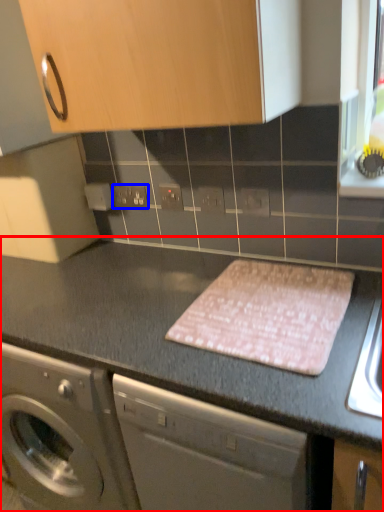
Question: Which of the following is the closest to the observer, countertop (highlighted by a red box) or electric outlet (highlighted by a blue box)?

Choices:
 (A) countertop
 (B) electric outlet

Answer: (A)